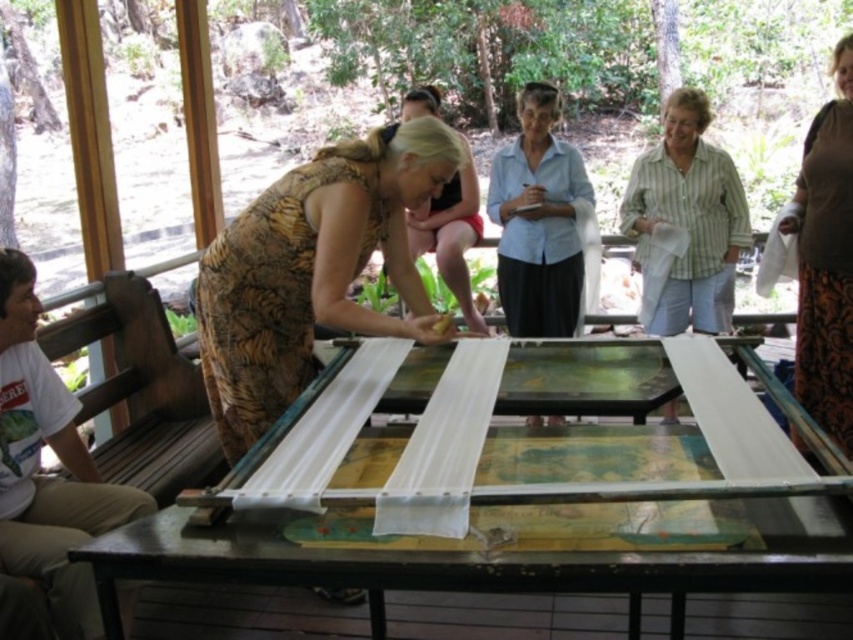
Who is lower down, metallic silver table at center or light blue shirt at center?

metallic silver table at center

Does point (635, 612) come in front of point (540, 150)?

Yes, it is.

Measure the distance between point (102, 564) and camera.

They are 1.45 meters apart.

This screenshot has height=640, width=853. I want to click on metallic silver table at center, so click(x=489, y=561).

Measure the distance between point (709, 192) and camera.

A distance of 3.37 meters exists between point (709, 192) and camera.

Identify the location of green striped shirt at center. The height and width of the screenshot is (640, 853). (689, 216).

Does brown textured dress at center appear on the right side of metallic silver table at center?

Incorrect, brown textured dress at center is not on the right side of metallic silver table at center.

Who is taller, brown textured dress at center or metallic silver table at center?

brown textured dress at center

Find the location of a particular element. The height and width of the screenshot is (640, 853). brown textured dress at center is located at coordinates (312, 269).